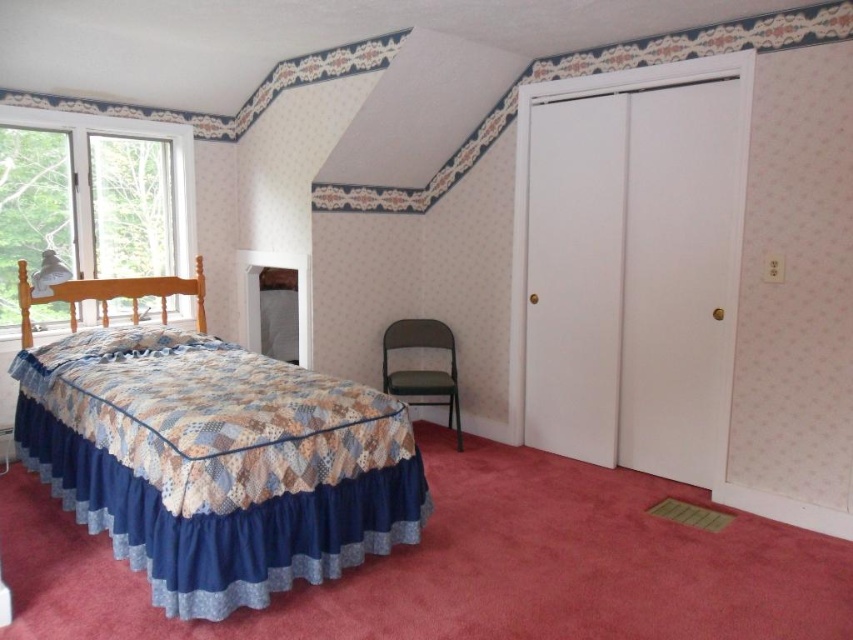
You are standing in the cozy bedroom with a slanted ceiling. You notice the patchwork fabric bed at left and the clear glass window at left. Which object is closer to you?

The patchwork fabric bed at left is closer to you because it is in front of the clear glass window at left.

You are standing in the cozy bedroom with a slanted ceiling. You notice a point marked at coordinates (216, 461). What object in the bedroom does this point correspond to?

The point at coordinates (216, 461) corresponds to the patchwork fabric bed at left.

You are trying to decide whether to place a large painting on the clear glass window at left or the matte green folding chair at center. Which surface can accommodate a wider artwork?

The clear glass window at left has a larger width than the matte green folding chair at center, so it can accommodate a wider artwork.